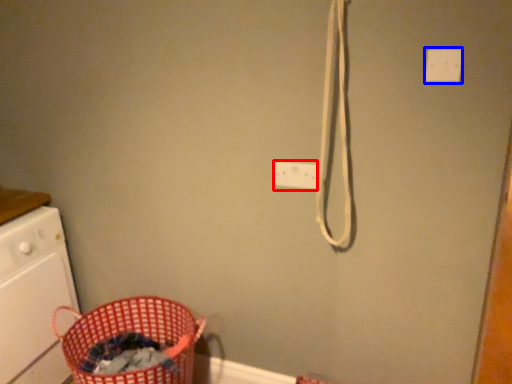
Question: Which object is closer to the camera taking this photo, electric outlet (highlighted by a red box) or light switch (highlighted by a blue box)?

Choices:
 (A) electric outlet
 (B) light switch

Answer: (B)